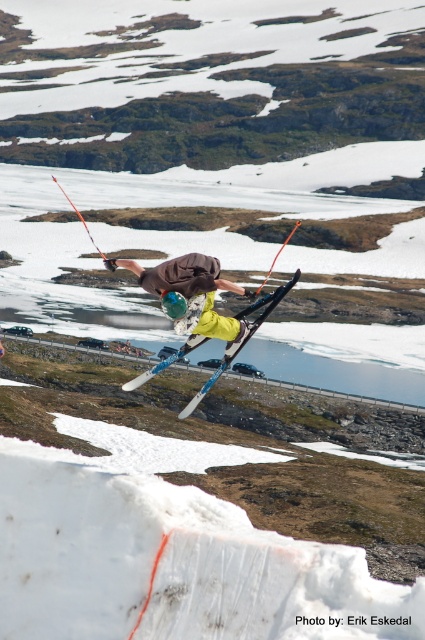
Between point (135, 273) and point (124, 387), which one is positioned in front?

Point (135, 273)

Which is more to the left, matte brown jacket at center or metallic blue skis at center?

matte brown jacket at center

This screenshot has width=425, height=640. What are the coordinates of `matte brown jacket at center` in the screenshot? It's located at (190, 289).